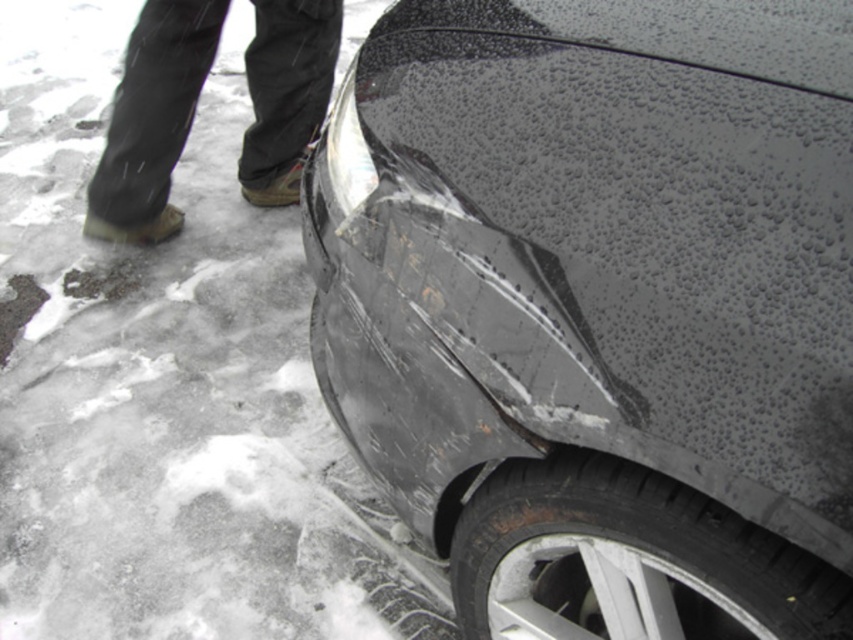
Question: Can you confirm if glossy metallic car at center is positioned to the left of black fabric pants at upper left?

Choices:
 (A) yes
 (B) no

Answer: (B)

Question: Which point is farther to the camera?

Choices:
 (A) (352, 125)
 (B) (109, 216)
 (C) (727, 609)

Answer: (B)

Question: Estimate the real-world distances between objects in this image. Which object is farther from the glossy metallic car at center?

Choices:
 (A) black rubber tire at lower right
 (B) black fabric pants at upper left

Answer: (B)

Question: From the image, what is the correct spatial relationship of glossy metallic car at center in relation to black rubber tire at lower right?

Choices:
 (A) below
 (B) above

Answer: (B)

Question: Does glossy metallic car at center have a smaller size compared to black fabric pants at upper left?

Choices:
 (A) yes
 (B) no

Answer: (B)

Question: Which point appears farthest from the camera in this image?

Choices:
 (A) (459, 580)
 (B) (525, 68)

Answer: (A)